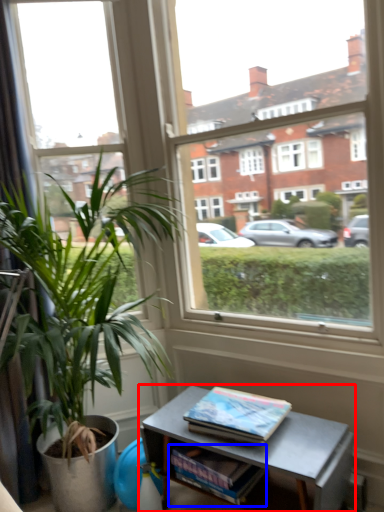
Question: Which point is further to the camera, table (highlighted by a red box) or magazine (highlighted by a blue box)?

Choices:
 (A) table
 (B) magazine

Answer: (B)